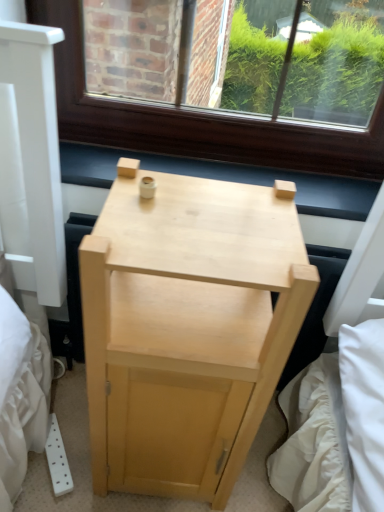
Describe the element at coordinates (225, 178) in the screenshot. This screenshot has width=384, height=512. I see `light wood at center` at that location.

Where is `light wood at center`? light wood at center is located at coordinates 225,178.

The width and height of the screenshot is (384, 512). Describe the element at coordinates (186, 329) in the screenshot. I see `natural wood nightstand at center` at that location.

The image size is (384, 512). What are the coordinates of `natural wood nightstand at center` in the screenshot? It's located at (186, 329).

Identify the location of light wood at center. (225, 178).

Can you confirm if light wood at center is positioned to the right of natural wood nightstand at center?

Indeed, light wood at center is positioned on the right side of natural wood nightstand at center.

Does light wood at center lie in front of natural wood nightstand at center?

No, it is behind natural wood nightstand at center.

Is point (300, 203) farther from viewer compared to point (263, 278)?

Yes.

From the image's perspective, which one is positioned higher, light wood at center or natural wood nightstand at center?

light wood at center appears higher in the image.

From a real-world perspective, who is located higher, light wood at center or natural wood nightstand at center?

light wood at center.

Which of these two, light wood at center or natural wood nightstand at center, is thinner?

With smaller width is light wood at center.

Between light wood at center and natural wood nightstand at center, which one has more height?

With more height is natural wood nightstand at center.

Looking at the image, does light wood at center seem bigger or smaller compared to natural wood nightstand at center?

light wood at center is smaller than natural wood nightstand at center.

Is light wood at center located outside natural wood nightstand at center?

Absolutely, light wood at center is external to natural wood nightstand at center.

Can you see light wood at center touching natural wood nightstand at center?

light wood at center and natural wood nightstand at center are clearly separated.

Could you tell me if light wood at center is facing natural wood nightstand at center?

Yes, light wood at center is aimed at natural wood nightstand at center.

Find the location of `window sill that is above the natural wood nightstand at center (from the image's perspective)`. window sill that is above the natural wood nightstand at center (from the image's perspective) is located at coordinates (x=225, y=178).

Is natural wood nightstand at center at the left side of light wood at center?

Yes.

Looking at this image, relative to light wood at center, is natural wood nightstand at center in front or behind?

natural wood nightstand at center is in front of light wood at center.

Does point (222, 344) lie in front of point (96, 186)?

Yes, it is.

From the image's perspective, who appears lower, natural wood nightstand at center or light wood at center?

natural wood nightstand at center appears lower in the image.

From a real-world perspective, relative to light wood at center, is natural wood nightstand at center vertically above or below?

natural wood nightstand at center is situated lower than light wood at center in the real world.

Which of these two, natural wood nightstand at center or light wood at center, is wider?

natural wood nightstand at center is wider.

Can you confirm if natural wood nightstand at center is taller than light wood at center?

Yes.

Considering the sizes of objects natural wood nightstand at center and light wood at center in the image provided, who is smaller, natural wood nightstand at center or light wood at center?

Smaller between the two is light wood at center.

Would you say natural wood nightstand at center is inside or outside light wood at center?

natural wood nightstand at center is not enclosed by light wood at center.

Can you see natural wood nightstand at center touching light wood at center?

natural wood nightstand at center and light wood at center are not in contact.

Is natural wood nightstand at center oriented towards light wood at center?

No, natural wood nightstand at center is not oriented towards light wood at center.

Where is `window sill that is above the natural wood nightstand at center (from a real-world perspective)`? window sill that is above the natural wood nightstand at center (from a real-world perspective) is located at coordinates (225, 178).

Find the location of `nightstand below the light wood at center (from a real-world perspective)`. nightstand below the light wood at center (from a real-world perspective) is located at coordinates (186, 329).

The height and width of the screenshot is (512, 384). In order to click on nightstand below the light wood at center (from the image's perspective) in this screenshot , I will do `click(186, 329)`.